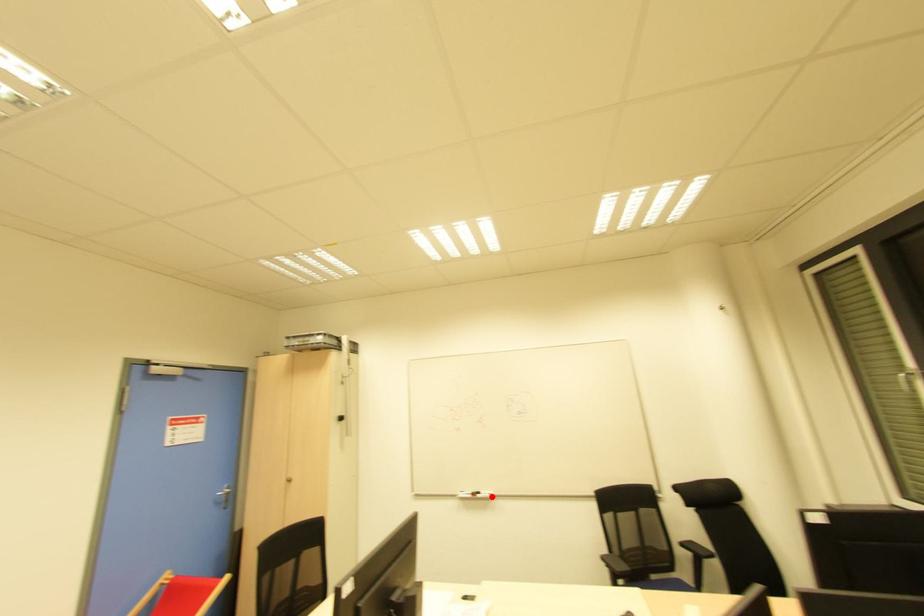
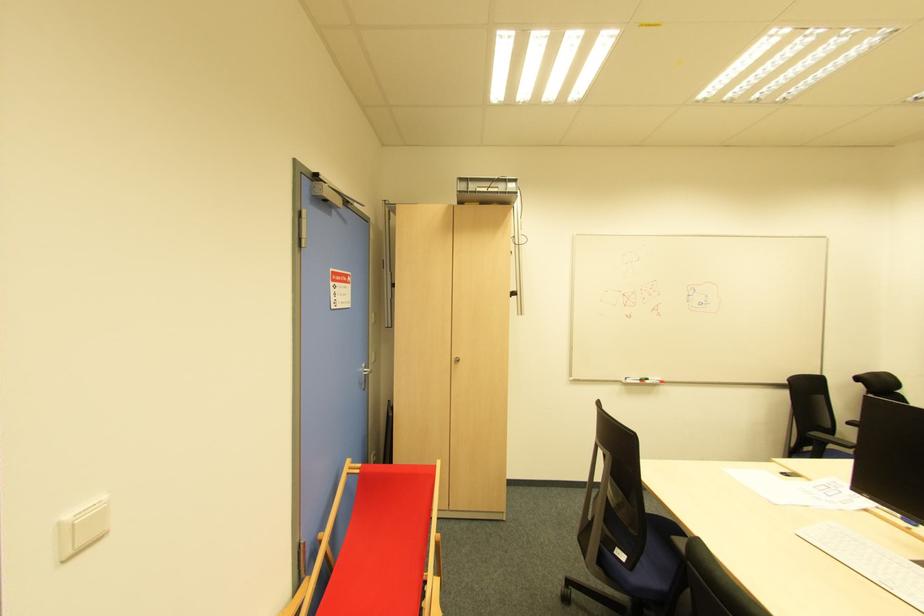
Locate, in the second image, the point that corresponds to the highlighted location in the first image.

(662, 383)